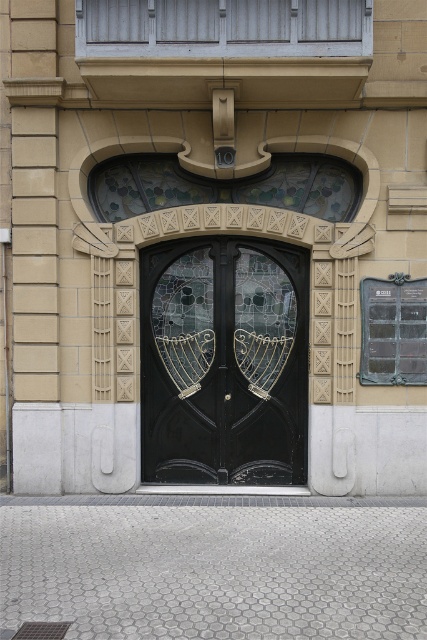
Between stained glass doors at center and transparent glass at center, which one has more height?

Standing taller between the two is stained glass doors at center.

Can you confirm if stained glass doors at center is positioned below transparent glass at center?

Correct, stained glass doors at center is located below transparent glass at center.

Who is more forward, (140, 445) or (411, 324)?

Point (411, 324) is more forward.

Locate an element on the screen. This screenshot has height=640, width=427. stained glass doors at center is located at coordinates (224, 362).